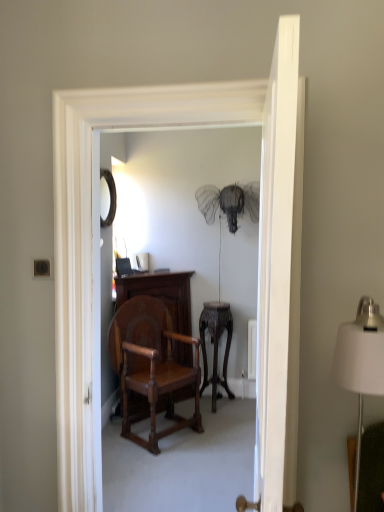
Question: From a real-world perspective, is polished wood chair at center positioned above or below white smooth door at center?

Choices:
 (A) below
 (B) above

Answer: (A)

Question: Is polished wood chair at center to the left or to the right of white smooth door at center in the image?

Choices:
 (A) right
 (B) left

Answer: (B)

Question: Which object is the farthest from the polished wood vanity at center?

Choices:
 (A) matte black mirror at upper left
 (B) white fabric lampshade at right
 (C) polished wood chair at center
 (D) dark wood side table at center
 (E) white smooth door at center

Answer: (E)

Question: Which of these objects is positioned closest to the polished wood vanity at center?

Choices:
 (A) white smooth door at center
 (B) polished wood chair at center
 (C) dark wood side table at center
 (D) matte black mirror at upper left
 (E) white fabric lampshade at right

Answer: (C)